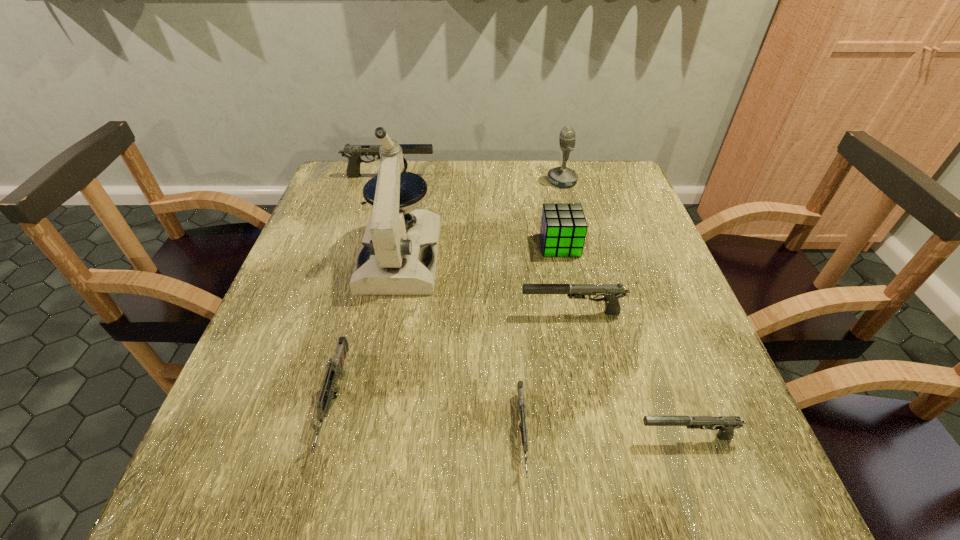
Find the location of `vacant region located aimed along the barrel of the left grey gun`. vacant region located aimed along the barrel of the left grey gun is located at coordinates (306, 511).

Locate an element on the screen. The width and height of the screenshot is (960, 540). free space located at the muzzle end of the nearest gray gun is located at coordinates (570, 437).

You are a GUI agent. You are given a task and a screenshot of the screen. Output one action in this format:
    pyautogui.click(x=<x>, y=<y>)
    Task: Click on the blank space located 0.380m at the muzzle end of the nearest gray gun
    This screenshot has width=960, height=540.
    Given the screenshot: What is the action you would take?
    [407, 437]

The height and width of the screenshot is (540, 960). In order to click on vacant space situated 0.200m at the muzzle end of the nearest gray gun in this screenshot , I will do `click(516, 437)`.

The image size is (960, 540). I want to click on microphone located at the far edge, so (x=562, y=176).

Locate an element on the screen. The image size is (960, 540). gun that is at the far edge is located at coordinates (353, 152).

This screenshot has height=540, width=960. What are the coordinates of `microscope that is positioned at the left edge` in the screenshot? It's located at (393, 260).

Find the location of a particular element. The width and height of the screenshot is (960, 540). gun that is at the left edge is located at coordinates (353, 152).

Find the location of `microphone positioned at the right edge`. microphone positioned at the right edge is located at coordinates (562, 176).

This screenshot has width=960, height=540. Find the location of `object positioned at the far left corner`. object positioned at the far left corner is located at coordinates (353, 152).